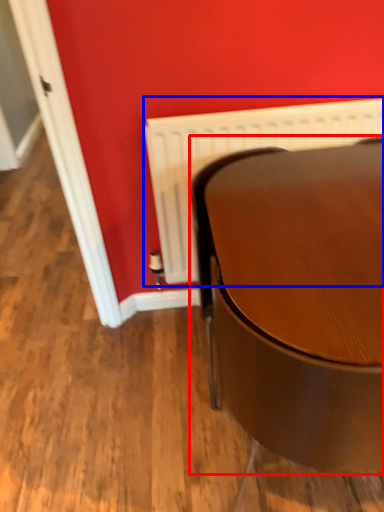
Question: Among these objects, which one is farthest to the camera, table (highlighted by a red box) or radiator (highlighted by a blue box)?

Choices:
 (A) table
 (B) radiator

Answer: (B)